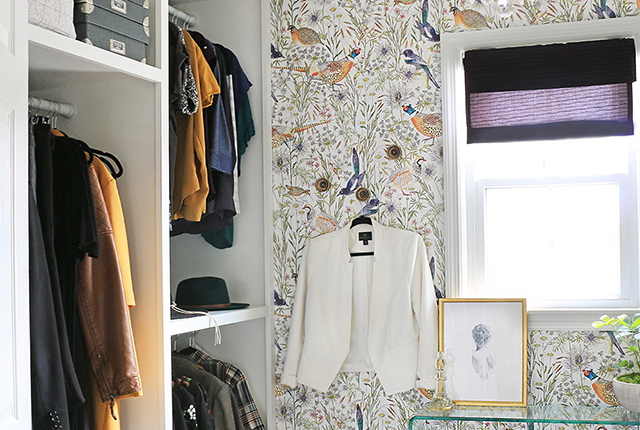
The image size is (640, 430). I want to click on window, so click(x=541, y=236).